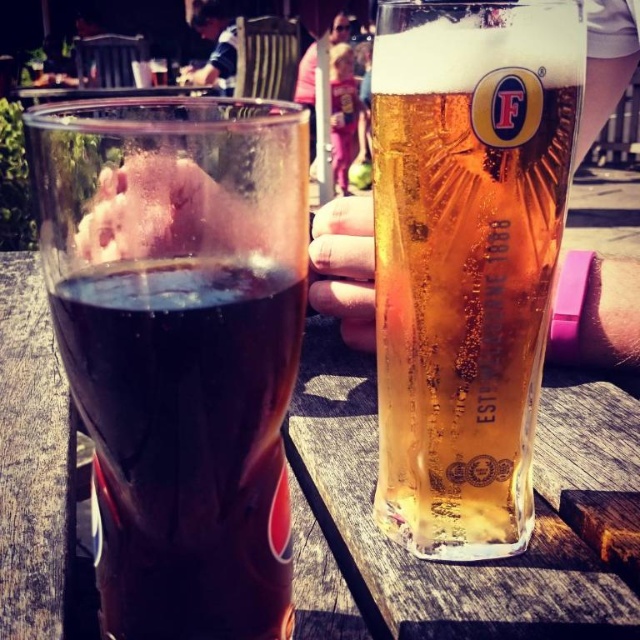
Is transparent glass at center thinner than wooden table at center?

Yes, transparent glass at center is thinner than wooden table at center.

Is transparent glass at center wider than wooden table at center?

Incorrect, transparent glass at center's width does not surpass wooden table at center's.

Does point (112, 134) come in front of point (628, 620)?

Yes, point (112, 134) is in front of point (628, 620).

Identify the location of transparent glass at center. [x=179, y=346].

Which of these two, golden glass beer at center or wooden table at center, stands taller?

golden glass beer at center is taller.

Looking at this image, is golden glass beer at center to the left of wooden table at center from the viewer's perspective?

No, golden glass beer at center is not to the left of wooden table at center.

Identify the location of golden glass beer at center. The width and height of the screenshot is (640, 640). (467, 259).

Which is below, transparent glass at center or golden glass beer at center?

Result: Positioned lower is transparent glass at center.

Does point (179, 596) come in front of point (394, 388)?

That is True.

Is point (268, 458) behind point (458, 188)?

No, it is not.

You are a GUI agent. You are given a task and a screenshot of the screen. Output one action in this format:
    pyautogui.click(x=<x>, y=<y>)
    Task: Click on the transparent glass at center
    This screenshot has width=640, height=640.
    Given the screenshot: What is the action you would take?
    pyautogui.click(x=179, y=346)